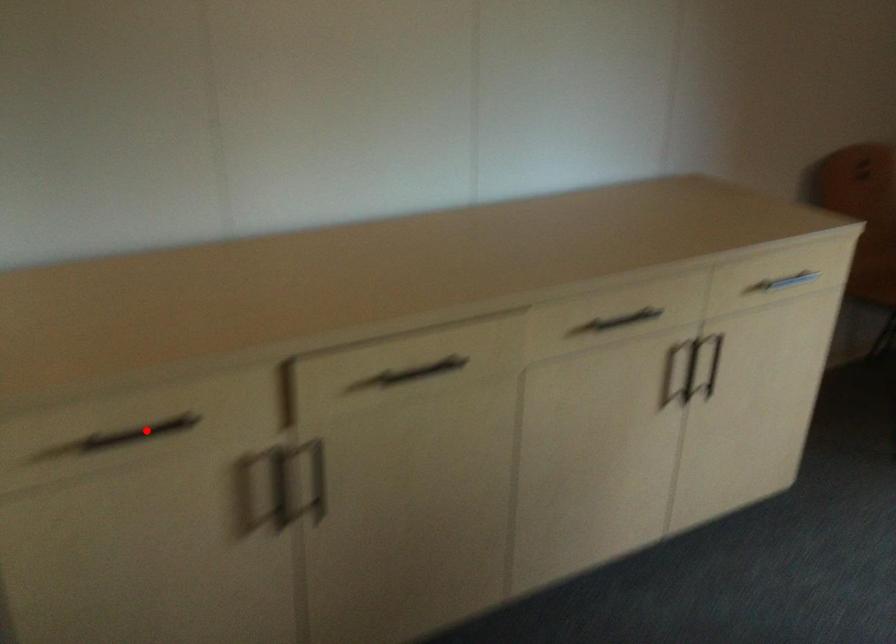
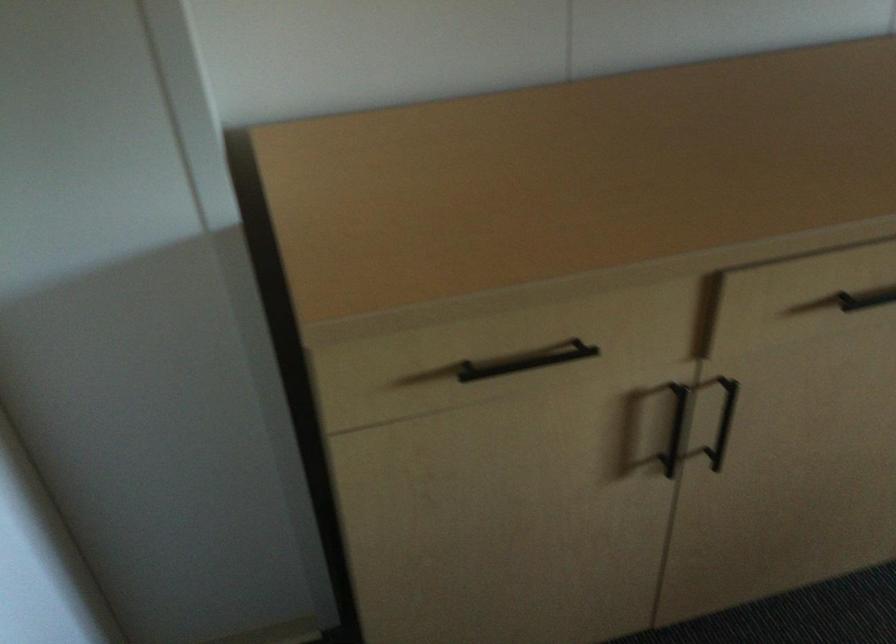
The point at the highlighted location is marked in the first image. Where is the corresponding point in the second image?

(526, 361)